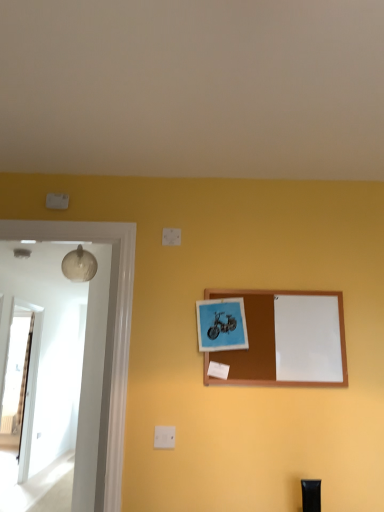
Question: Is wooden corkboard at center, which ranks as the 1th picture frame in right-to-left order, next to transparent glass door at left?

Choices:
 (A) no
 (B) yes

Answer: (A)

Question: Does wooden corkboard at center, which ranks as the 1th picture frame in right-to-left order, appear on the right side of transparent glass door at left?

Choices:
 (A) no
 (B) yes

Answer: (B)

Question: Are wooden corkboard at center, which ranks as the 1th picture frame in right-to-left order, and transparent glass door at left far apart?

Choices:
 (A) yes
 (B) no

Answer: (A)

Question: Does wooden corkboard at center, the 2th picture frame in the left-to-right sequence, have a larger size compared to transparent glass door at left?

Choices:
 (A) no
 (B) yes

Answer: (A)

Question: Does wooden corkboard at center, the 2th picture frame in the left-to-right sequence, turn towards transparent glass door at left?

Choices:
 (A) yes
 (B) no

Answer: (B)

Question: Relative to matte blue picture frame at center, the 2th picture frame when ordered from right to left, is black plastic tube at lower right in front or behind?

Choices:
 (A) front
 (B) behind

Answer: (A)

Question: Is black plastic tube at lower right wider or thinner than matte blue picture frame at center, which is the 1th picture frame from left to right?

Choices:
 (A) thin
 (B) wide

Answer: (A)

Question: Considering the positions of black plastic tube at lower right and matte blue picture frame at center, which is the 1th picture frame from left to right, in the image, is black plastic tube at lower right taller or shorter than matte blue picture frame at center, which is the 1th picture frame from left to right,?

Choices:
 (A) tall
 (B) short

Answer: (B)

Question: Considering the relative positions of black plastic tube at lower right and matte blue picture frame at center, the 2th picture frame when ordered from right to left, in the image provided, is black plastic tube at lower right to the left or to the right of matte blue picture frame at center, the 2th picture frame when ordered from right to left,?

Choices:
 (A) left
 (B) right

Answer: (B)

Question: From a real-world perspective, is black plastic tube at lower right physically located above or below wooden corkboard at center, which ranks as the 1th picture frame in right-to-left order?

Choices:
 (A) above
 (B) below

Answer: (B)

Question: Considering the positions of point (311, 506) and point (276, 307), is point (311, 506) closer or farther from the camera than point (276, 307)?

Choices:
 (A) farther
 (B) closer

Answer: (B)

Question: Is black plastic tube at lower right spatially inside wooden corkboard at center, which ranks as the 1th picture frame in right-to-left order, or outside of it?

Choices:
 (A) outside
 (B) inside

Answer: (A)

Question: Considering the positions of black plastic tube at lower right and wooden corkboard at center, the 2th picture frame in the left-to-right sequence, in the image, is black plastic tube at lower right taller or shorter than wooden corkboard at center, the 2th picture frame in the left-to-right sequence,?

Choices:
 (A) short
 (B) tall

Answer: (A)

Question: Considering the relative positions of transparent glass door at left and wooden corkboard at center, which ranks as the 1th picture frame in right-to-left order, in the image provided, is transparent glass door at left to the left or to the right of wooden corkboard at center, which ranks as the 1th picture frame in right-to-left order,?

Choices:
 (A) right
 (B) left

Answer: (B)

Question: From their relative heights in the image, would you say transparent glass door at left is taller or shorter than wooden corkboard at center, which ranks as the 1th picture frame in right-to-left order?

Choices:
 (A) tall
 (B) short

Answer: (A)